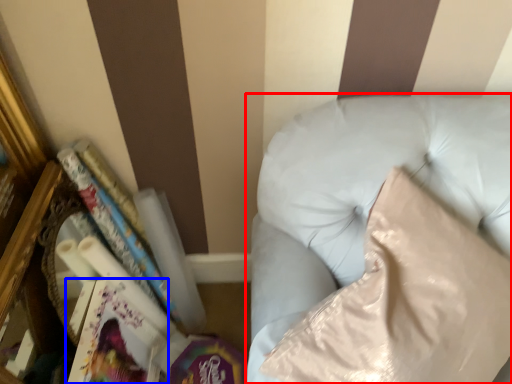
Question: Which point is further to the camera, furniture (highlighted by a red box) or paperback book (highlighted by a blue box)?

Choices:
 (A) furniture
 (B) paperback book

Answer: (B)